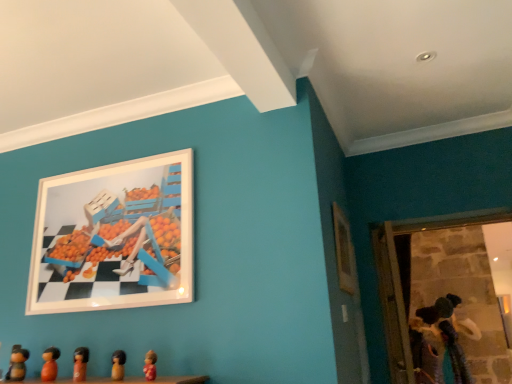
Question: Could you tell me if wooden picture frame at upper right, which is the 2th picture frame from left to right, is facing matte pink figurine at lower center, which is the first toy from front to back?

Choices:
 (A) yes
 (B) no

Answer: (B)

Question: From the image's perspective, is wooden picture frame at upper right, which is the 1th picture frame from right to left, located above matte pink figurine at lower center, placed as the sixth toy when sorted from back to front?

Choices:
 (A) no
 (B) yes

Answer: (B)

Question: Is wooden picture frame at upper right, which is the 1th picture frame from right to left, turned away from matte pink figurine at lower center, positioned as the first toy in top-to-bottom order?

Choices:
 (A) yes
 (B) no

Answer: (B)

Question: Considering the relative sizes of wooden picture frame at upper right, which is the 2th picture frame from left to right, and matte pink figurine at lower center, which is the first toy from front to back, in the image provided, is wooden picture frame at upper right, which is the 2th picture frame from left to right, taller than matte pink figurine at lower center, which is the first toy from front to back,?

Choices:
 (A) yes
 (B) no

Answer: (A)

Question: Does wooden picture frame at upper right, which is the 2th picture frame from left to right, appear on the right side of matte pink figurine at lower center, positioned as the fifth toy in left-to-right order?

Choices:
 (A) no
 (B) yes

Answer: (B)

Question: Is wooden picture frame at upper right, which is the 2th picture frame from left to right, smaller than matte pink figurine at lower center, positioned as the fifth toy in left-to-right order?

Choices:
 (A) no
 (B) yes

Answer: (A)

Question: Is wooden figurine at lower left, the sixth toy viewed from the right, at the back of wooden figurine at lower center, acting as the 5th toy starting from the bottom?

Choices:
 (A) no
 (B) yes

Answer: (A)

Question: From the image's perspective, is wooden figurine at lower center, acting as the 4th toy starting from the left, on wooden figurine at lower left, which ranks as the 2th toy in back-to-front order?

Choices:
 (A) yes
 (B) no

Answer: (A)

Question: Does wooden figurine at lower center, the 3th toy positioned from the right, have a lesser width compared to wooden figurine at lower left, the sixth toy viewed from the right?

Choices:
 (A) yes
 (B) no

Answer: (A)

Question: Is wooden figurine at lower center, which is the 2th toy from front to back, closer to camera compared to wooden figurine at lower left, the 1th toy positioned from the left?

Choices:
 (A) no
 (B) yes

Answer: (B)

Question: From a real-world perspective, is wooden figurine at lower center, placed as the fifth toy when sorted from back to front, located higher than wooden figurine at lower left, the fifth toy when ordered from top to bottom?

Choices:
 (A) yes
 (B) no

Answer: (B)

Question: Can you confirm if wooden figurine at lower center, acting as the 4th toy starting from the left, is positioned to the right of wooden figurine at lower left, which ranks as the 2th toy in back-to-front order?

Choices:
 (A) no
 (B) yes

Answer: (B)

Question: Considering the relative sizes of wooden figurine at lower left, the fifth toy when ordered from top to bottom, and white glossy picture frame at upper left, the second picture frame from the right, in the image provided, is wooden figurine at lower left, the fifth toy when ordered from top to bottom, thinner than white glossy picture frame at upper left, the second picture frame from the right,?

Choices:
 (A) no
 (B) yes

Answer: (A)